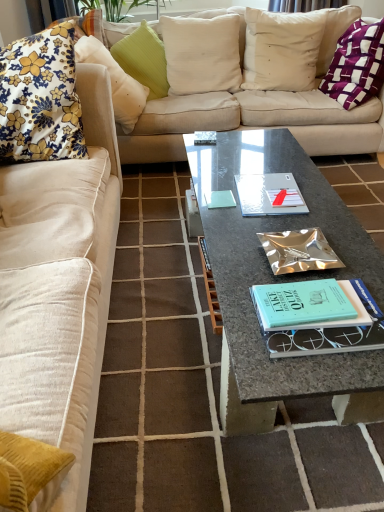
Question: Should I look upward or downward to see green textured pillow at upper center, positioned as the 3th pillow in left-to-right order?

Choices:
 (A) down
 (B) up

Answer: (B)

Question: Is purple woven pillow at upper right, arranged as the 6th pillow when viewed from the left, in front of granite coffee table at center?

Choices:
 (A) yes
 (B) no

Answer: (B)

Question: Would you consider purple woven pillow at upper right, positioned as the 1th pillow in right-to-left order, to be distant from granite coffee table at center?

Choices:
 (A) yes
 (B) no

Answer: (A)

Question: From a real-world perspective, is purple woven pillow at upper right, arranged as the 6th pillow when viewed from the left, physically above granite coffee table at center?

Choices:
 (A) no
 (B) yes

Answer: (B)

Question: Is granite coffee table at center completely or partially inside purple woven pillow at upper right, arranged as the 6th pillow when viewed from the left?

Choices:
 (A) no
 (B) yes

Answer: (A)

Question: Is purple woven pillow at upper right, arranged as the 6th pillow when viewed from the left, to the right of granite coffee table at center from the viewer's perspective?

Choices:
 (A) yes
 (B) no

Answer: (A)

Question: Does purple woven pillow at upper right, arranged as the 6th pillow when viewed from the left, have a lesser height compared to granite coffee table at center?

Choices:
 (A) no
 (B) yes

Answer: (A)

Question: Does floral fabric cushion at upper left, the fifth pillow viewed from the right, appear on the left side of metallic silver book at center?

Choices:
 (A) no
 (B) yes

Answer: (B)

Question: Considering the relative sizes of floral fabric cushion at upper left, which appears as the 2th pillow when viewed from the left, and metallic silver book at center in the image provided, is floral fabric cushion at upper left, which appears as the 2th pillow when viewed from the left, taller than metallic silver book at center?

Choices:
 (A) no
 (B) yes

Answer: (B)

Question: Is the depth of floral fabric cushion at upper left, which appears as the 2th pillow when viewed from the left, less than that of metallic silver book at center?

Choices:
 (A) yes
 (B) no

Answer: (B)

Question: Would you consider floral fabric cushion at upper left, the fifth pillow viewed from the right, to be distant from metallic silver book at center?

Choices:
 (A) yes
 (B) no

Answer: (A)

Question: Can you confirm if floral fabric cushion at upper left, which appears as the 2th pillow when viewed from the left, is shorter than metallic silver book at center?

Choices:
 (A) no
 (B) yes

Answer: (A)

Question: Considering the relative sizes of floral fabric cushion at upper left, which appears as the 2th pillow when viewed from the left, and metallic silver book at center in the image provided, is floral fabric cushion at upper left, which appears as the 2th pillow when viewed from the left, smaller than metallic silver book at center?

Choices:
 (A) yes
 (B) no

Answer: (B)

Question: Does white cotton pillow at upper center, marked as the second pillow in a right-to-left arrangement, have a lesser height compared to white linen pillow at upper center, which is the third pillow in right-to-left order?

Choices:
 (A) yes
 (B) no

Answer: (B)